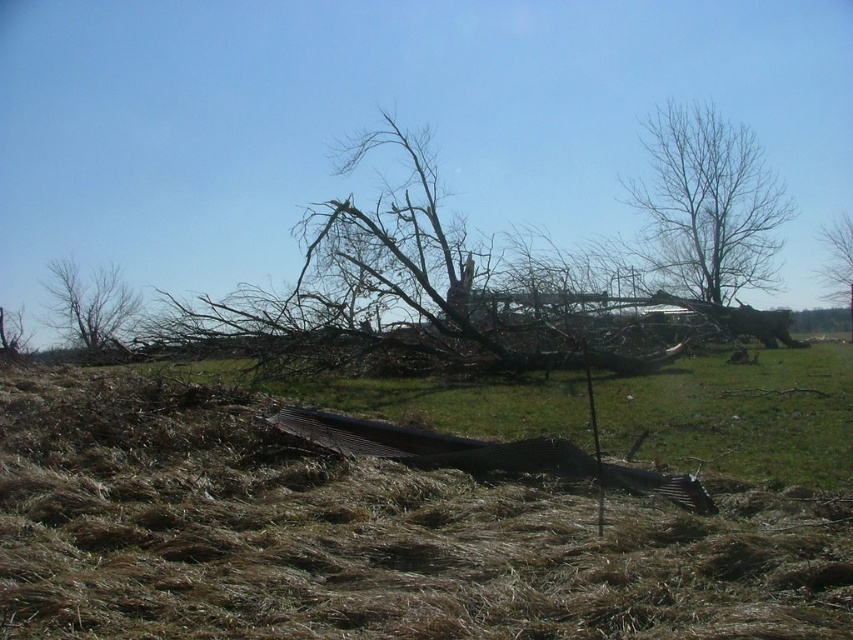
Who is positioned more to the left, brown/dry wood at center or brown dry grass at lower center?

brown/dry wood at center is more to the left.

Which is below, brown/dry wood at center or brown dry grass at lower center?

Positioned lower is brown dry grass at lower center.

This screenshot has width=853, height=640. What do you see at coordinates (514, 273) in the screenshot? I see `brown/dry wood at center` at bounding box center [514, 273].

This screenshot has width=853, height=640. I want to click on brown/dry wood at center, so click(514, 273).

Does bare branches at upper right come in front of bare branches at right?

Yes, it is in front of bare branches at right.

Does bare branches at upper right have a greater width compared to bare branches at right?

Yes.

The height and width of the screenshot is (640, 853). What do you see at coordinates (706, 205) in the screenshot? I see `bare branches at upper right` at bounding box center [706, 205].

This screenshot has height=640, width=853. Find the location of `bare branches at upper right`. bare branches at upper right is located at coordinates (706, 205).

Can you confirm if brown dry grass at center is taller than bare branches at left?

No.

Image resolution: width=853 pixels, height=640 pixels. What do you see at coordinates (364, 536) in the screenshot?
I see `brown dry grass at center` at bounding box center [364, 536].

Between point (177, 595) and point (74, 344), which one is positioned in front?

Point (177, 595) is more forward.

This screenshot has width=853, height=640. Identify the location of brown dry grass at center. (364, 536).